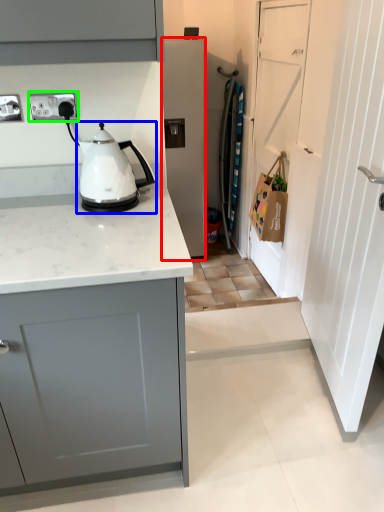
Question: Estimate the real-world distances between objects in this image. Which object is farther from home appliance (highlighted by a red box), kitchen appliance (highlighted by a blue box) or electric outlet (highlighted by a green box)?

Choices:
 (A) kitchen appliance
 (B) electric outlet

Answer: (B)